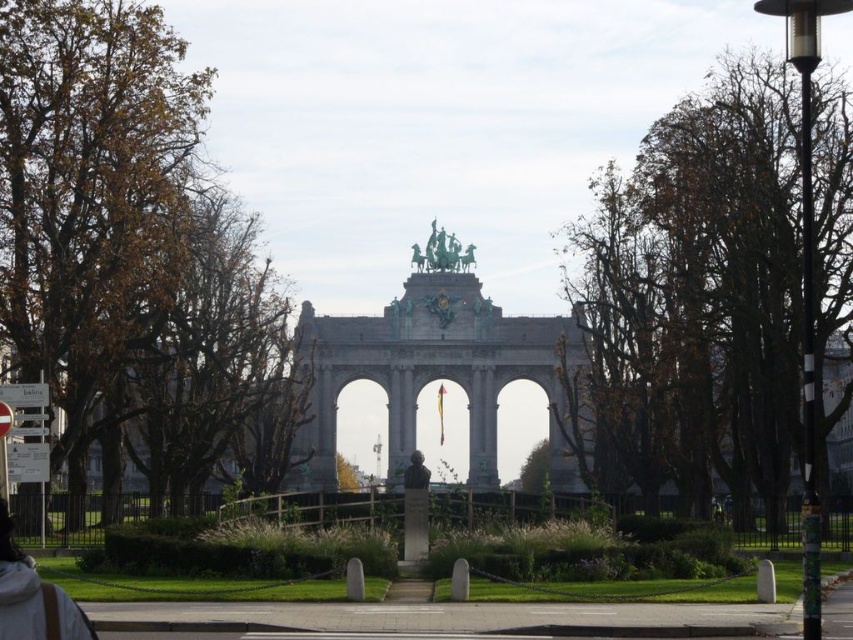
Who is more forward, (195, 172) or (426, 474)?

Positioned in front is point (426, 474).

What do you see at coordinates (129, 248) in the screenshot?
I see `brown leafy tree at left` at bounding box center [129, 248].

Find the location of `brown leafy tree at left`. brown leafy tree at left is located at coordinates (129, 248).

Is brown leafy tree at right behind bronze statue at center?

That is False.

Who is more forward, (672, 468) or (447, 236)?

Point (672, 468)

Find the location of a particular element. brown leafy tree at right is located at coordinates (701, 292).

Identify the location of brown leafy tree at right. (701, 292).

Describe the element at coordinates (32, 596) in the screenshot. The height and width of the screenshot is (640, 853). I see `white fabric at lower left` at that location.

Is the position of white fabric at lower left less distant than that of bronze bust at center?

Yes, it is in front of bronze bust at center.

Where is `white fabric at lower left`? white fabric at lower left is located at coordinates coord(32,596).

Find the location of a particular element. This screenshot has height=640, width=853. white fabric at lower left is located at coordinates (32, 596).